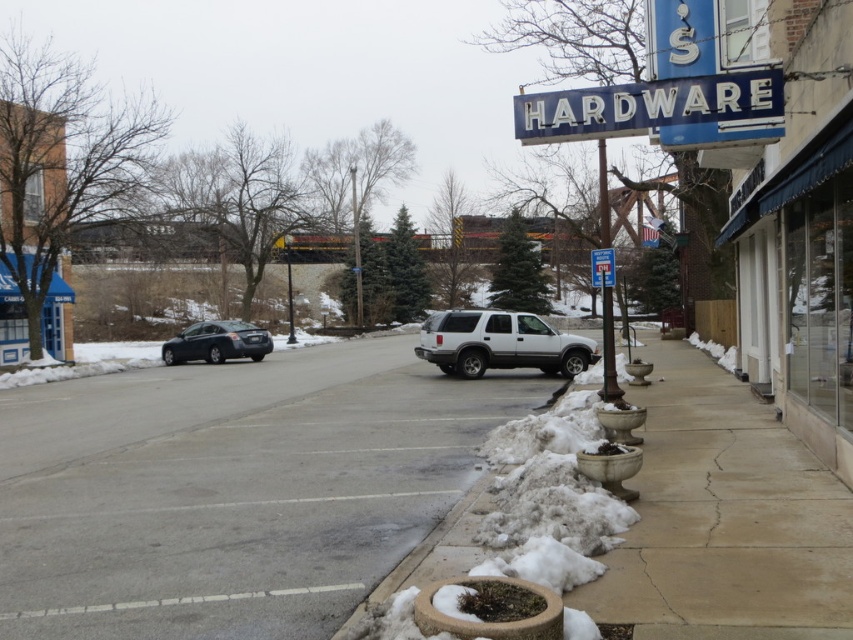
Question: Where is gray asphalt pavement at center located in relation to blue plastic sign at center-right in the image?

Choices:
 (A) left
 (B) right

Answer: (A)

Question: Is gray asphalt pavement at center thinner than satin black sedan at center-left?

Choices:
 (A) no
 (B) yes

Answer: (A)

Question: Is gray asphalt pavement at center thinner than satin black sedan at center-left?

Choices:
 (A) no
 (B) yes

Answer: (A)

Question: Which point appears closest to the camera in this image?

Choices:
 (A) (601, 266)
 (B) (339, 568)

Answer: (B)

Question: Among these objects, which one is nearest to the camera?

Choices:
 (A) satin black sedan at center-left
 (B) silver metallic suv at center
 (C) blue plastic sign at center-right
 (D) blue metallic sign at upper center

Answer: (D)

Question: Estimate the real-world distances between objects in this image. Which object is farther from the gray asphalt pavement at center?

Choices:
 (A) satin black sedan at center-left
 (B) silver metallic suv at center
 (C) blue plastic sign at center-right
 (D) blue metallic sign at upper center

Answer: (A)